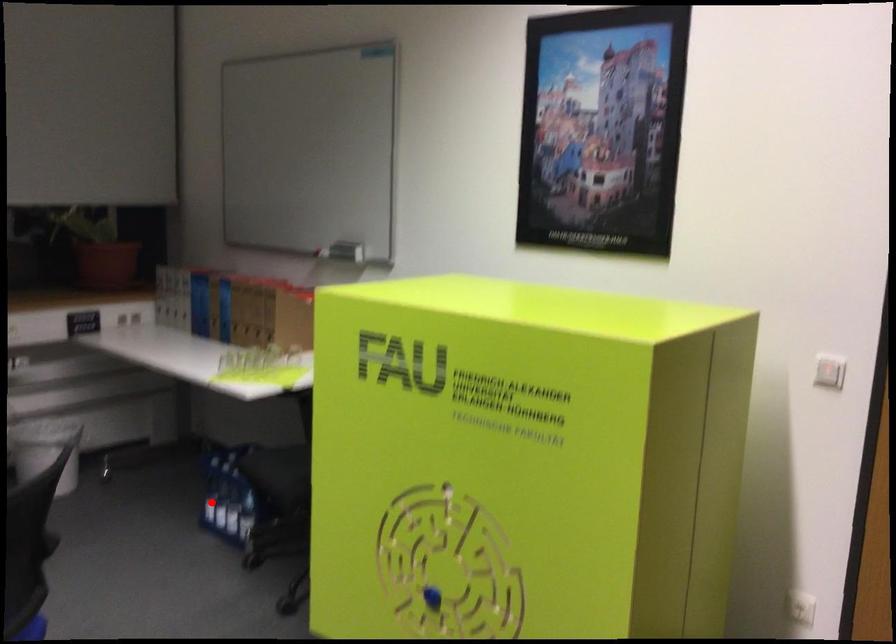
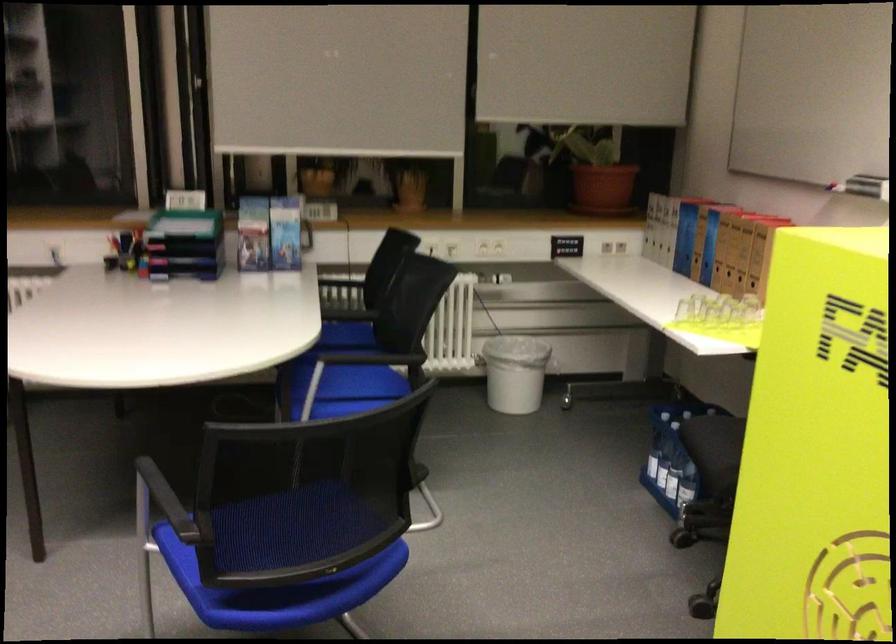
Question: A red point is marked in image1. In image2, is the corresponding 3D point closer to the camera or farther? Reply with the corresponding letter.

Choices:
 (A) The corresponding 3D point is closer.
 (B) The corresponding 3D point is farther.

Answer: (A)